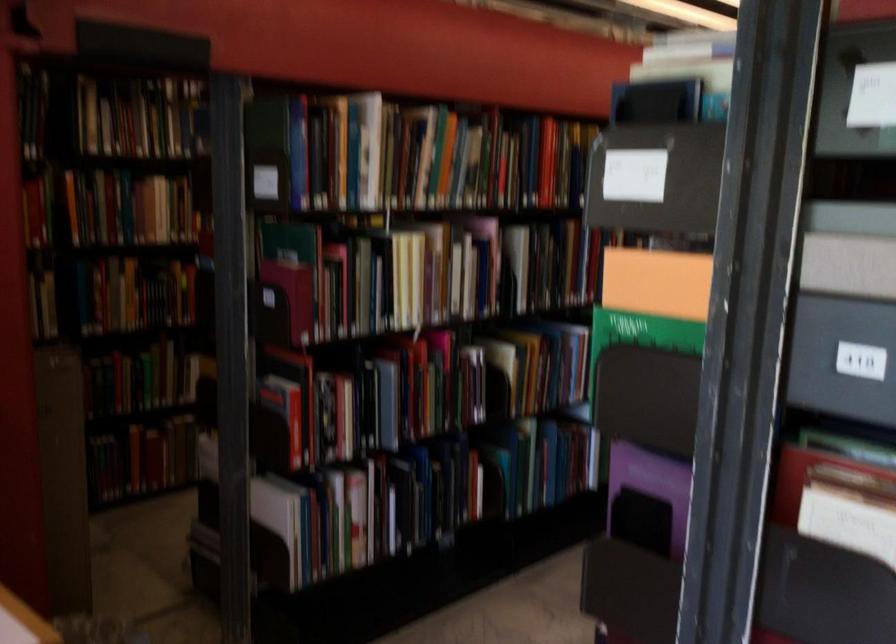
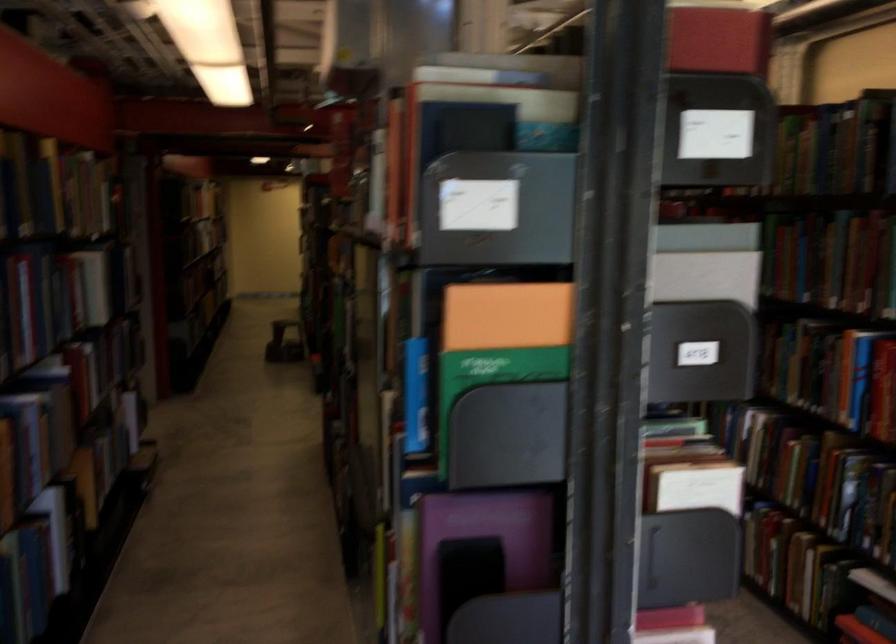
In the second image, find the point that corresponds to (x=644, y=335) in the first image.

(490, 379)